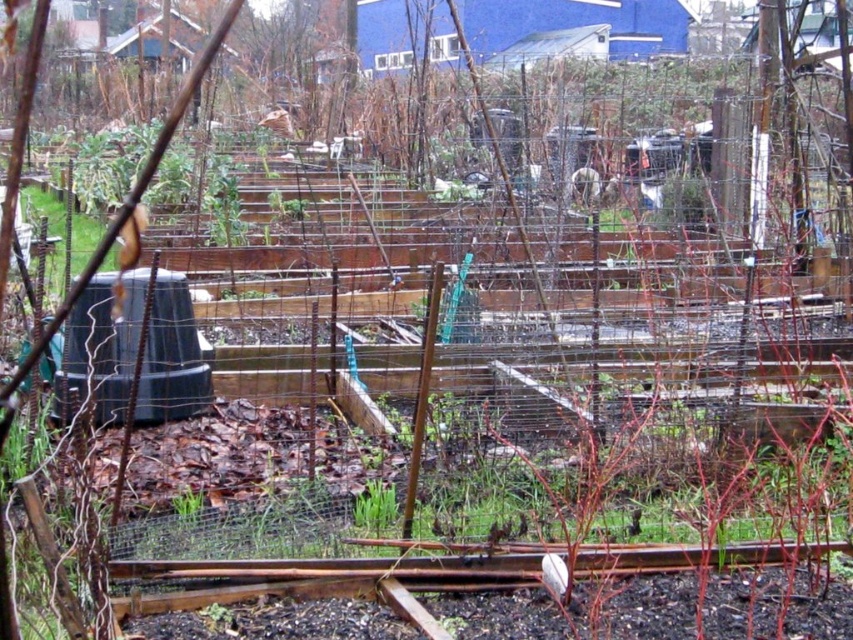
Is point (367, 509) positioned in front of point (183, 497)?

Yes, it is.

Which of these two, green leafy plant at center or green grass at center, stands shorter?

Standing shorter between the two is green grass at center.

Between point (386, 493) and point (190, 496), which one is positioned in front?

Point (386, 493)

Find the location of a particular element. Image resolution: width=853 pixels, height=640 pixels. green leafy plant at center is located at coordinates (375, 506).